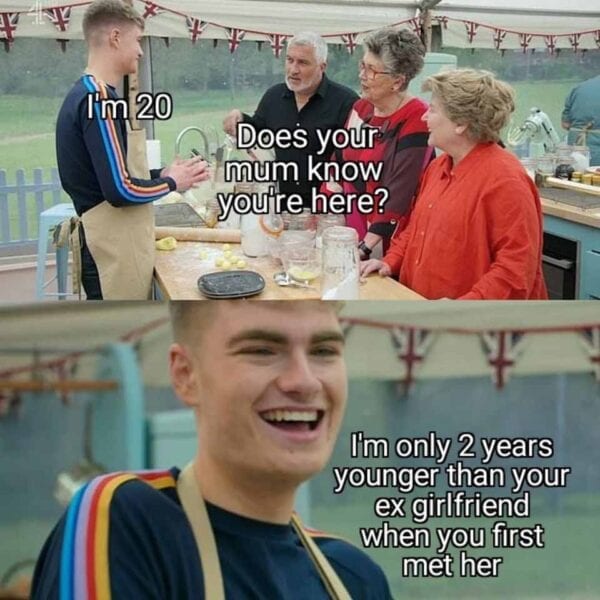
This screenshot has height=600, width=600. In order to click on black plate in this screenshot , I will do `click(242, 280)`.